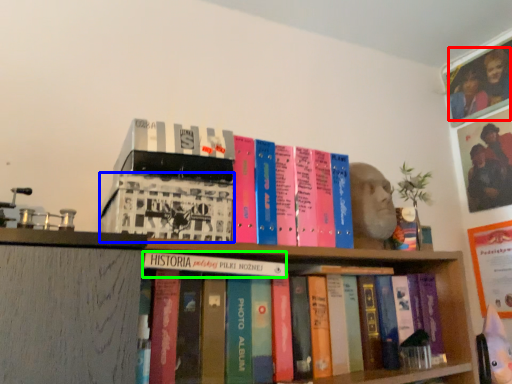
Question: Which is nearer to the couple (highlighted by a red box)? book (highlighted by a blue box) or book (highlighted by a green box).

Choices:
 (A) book
 (B) book

Answer: (B)